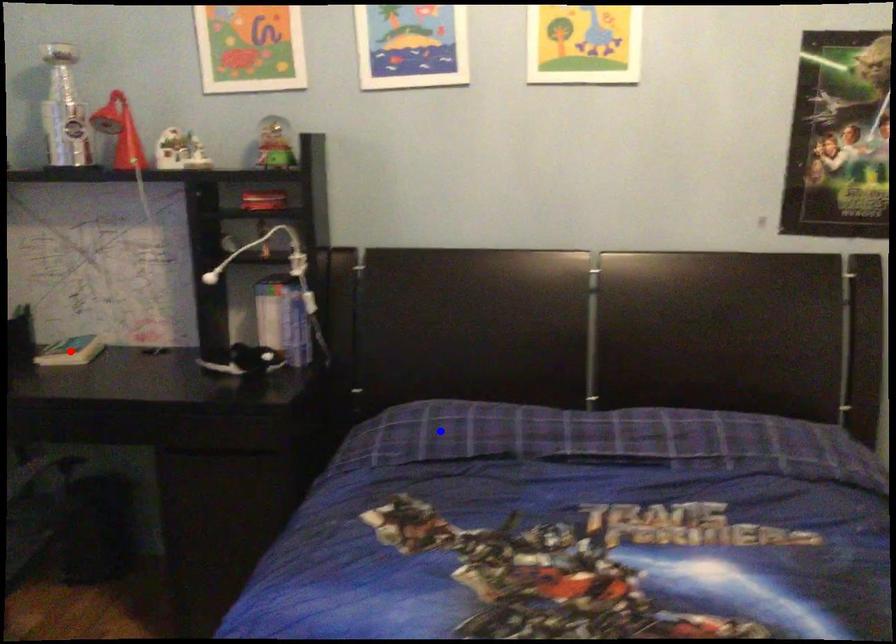
Question: In the image, two points are highlighted. Which point is nearer to the camera? Reply with the corresponding letter.

Choices:
 (A) blue point
 (B) red point

Answer: (A)